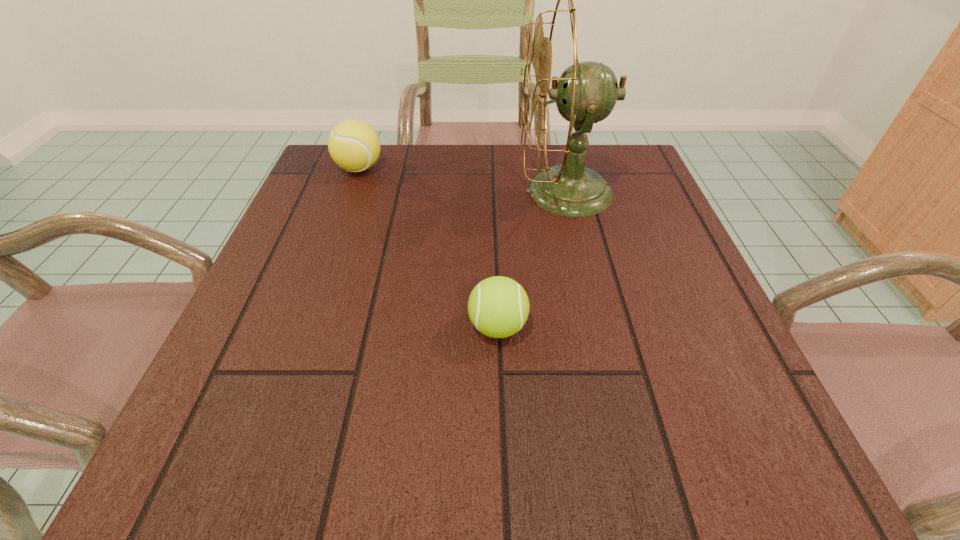
In the image, there is a desktop. Identify the location of vacant space at the right edge. This screenshot has width=960, height=540. [727, 333].

The image size is (960, 540). In order to click on vacant space at the far right corner of the desktop in this screenshot , I will do `click(625, 144)`.

Locate an element on the screen. The width and height of the screenshot is (960, 540). vacant region at the near right corner of the desktop is located at coordinates (770, 450).

Identify the location of free spot between the tallest object and the second object from right to left. The width and height of the screenshot is (960, 540). (532, 259).

Where is `vacant area between the fan and the left tennis ball`? The width and height of the screenshot is (960, 540). vacant area between the fan and the left tennis ball is located at coordinates (463, 180).

Identify the location of unoccupied position between the tallest object and the nearest object. (532, 259).

Where is `empty space between the second object from right to left and the left tennis ball`? empty space between the second object from right to left and the left tennis ball is located at coordinates (428, 247).

Locate an element on the screen. vacant space in between the rightmost object and the nearer tennis ball is located at coordinates (532, 259).

The image size is (960, 540). Identify the location of vacant point located between the tallest object and the second shortest object. (463, 180).

Locate an element on the screen. free space between the left tennis ball and the tallest object is located at coordinates (463, 180).